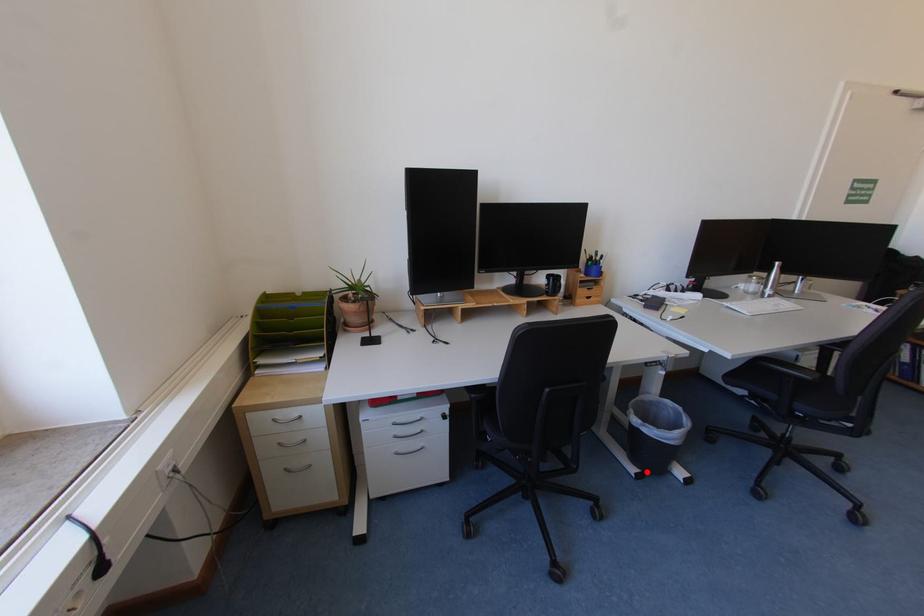
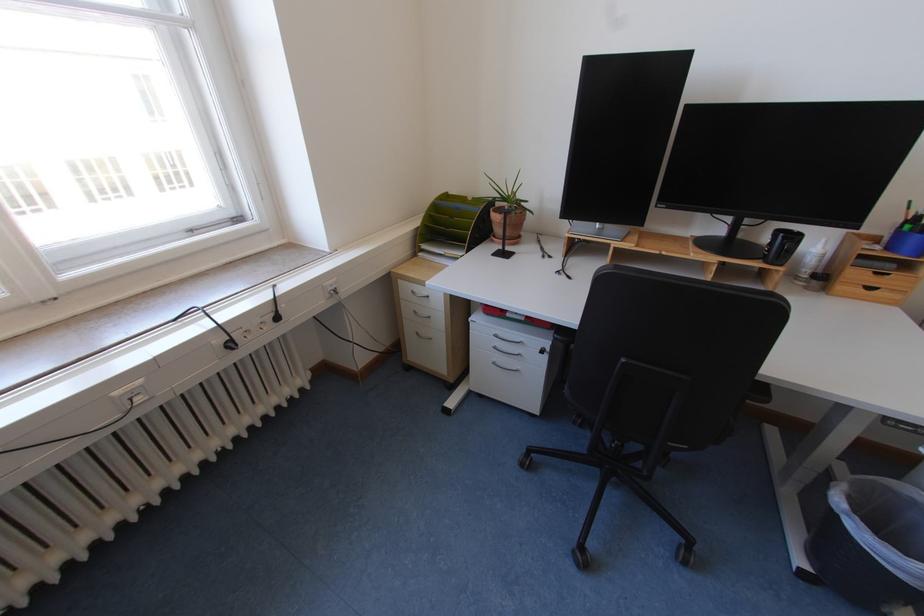
The point at the highlighted location is marked in the first image. Where is the corresponding point in the second image?

(819, 572)